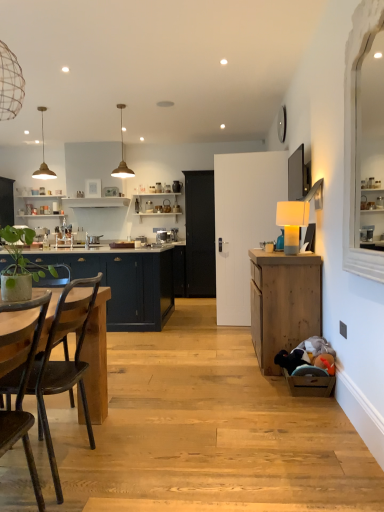
Question: Can you confirm if matte dark blue cabinets at left, the second cabinetry in the right-to-left sequence, is wider than black matte door at center?

Choices:
 (A) yes
 (B) no

Answer: (A)

Question: Is matte dark blue cabinets at left, the second cabinetry in the right-to-left sequence, surrounding black matte door at center?

Choices:
 (A) no
 (B) yes

Answer: (A)

Question: Can you confirm if matte dark blue cabinets at left, acting as the first cabinetry starting from the back, is bigger than black matte door at center?

Choices:
 (A) yes
 (B) no

Answer: (A)

Question: Can you confirm if matte dark blue cabinets at left, which ranks as the first cabinetry in left-to-right order, is positioned to the left of black matte door at center?

Choices:
 (A) yes
 (B) no

Answer: (A)

Question: Considering the relative positions of matte dark blue cabinets at left, which is the 2th cabinetry from front to back, and black matte door at center in the image provided, is matte dark blue cabinets at left, which is the 2th cabinetry from front to back, to the right of black matte door at center from the viewer's perspective?

Choices:
 (A) yes
 (B) no

Answer: (B)

Question: Considering the relative positions of matte gold pendant light at upper center, the 1th lamp positioned from the left, and wooden cabinet at right, the 1th cabinetry from the front, in the image provided, is matte gold pendant light at upper center, the 1th lamp positioned from the left, to the left or to the right of wooden cabinet at right, the 1th cabinetry from the front,?

Choices:
 (A) right
 (B) left

Answer: (B)

Question: From a real-world perspective, is matte gold pendant light at upper center, the second lamp viewed from the top, physically located above or below wooden cabinet at right, marked as the second cabinetry in a left-to-right arrangement?

Choices:
 (A) above
 (B) below

Answer: (A)

Question: Considering their positions, is matte gold pendant light at upper center, the first lamp positioned from the back, located in front of or behind wooden cabinet at right, the 1th cabinetry from the front?

Choices:
 (A) front
 (B) behind

Answer: (B)

Question: Considering the positions of matte gold pendant light at upper center, the 1th lamp positioned from the left, and wooden cabinet at right, which is the first cabinetry from right to left, in the image, is matte gold pendant light at upper center, the 1th lamp positioned from the left, taller or shorter than wooden cabinet at right, which is the first cabinetry from right to left,?

Choices:
 (A) tall
 (B) short

Answer: (B)

Question: In terms of width, does green matte plant at left look wider or thinner when compared to white matte lamp at right, marked as the third lamp in a back-to-front arrangement?

Choices:
 (A) wide
 (B) thin

Answer: (A)

Question: Does point (31, 241) appear closer or farther from the camera than point (279, 215)?

Choices:
 (A) closer
 (B) farther

Answer: (A)

Question: Would you say green matte plant at left is inside or outside white matte lamp at right, placed as the 3th lamp when sorted from top to bottom?

Choices:
 (A) outside
 (B) inside

Answer: (A)

Question: From their relative heights in the image, would you say green matte plant at left is taller or shorter than white matte lamp at right, which is the third lamp from left to right?

Choices:
 (A) tall
 (B) short

Answer: (B)

Question: Would you say satin silver toaster at center is to the left or to the right of black matte door at center in the picture?

Choices:
 (A) right
 (B) left

Answer: (B)

Question: Would you say satin silver toaster at center is inside or outside black matte door at center?

Choices:
 (A) outside
 (B) inside

Answer: (A)